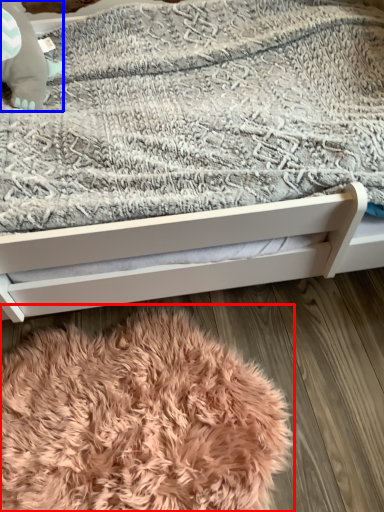
Question: Which object appears farthest to the camera in this image, blanket (highlighted by a red box) or baby elephant (highlighted by a blue box)?

Choices:
 (A) blanket
 (B) baby elephant

Answer: (B)